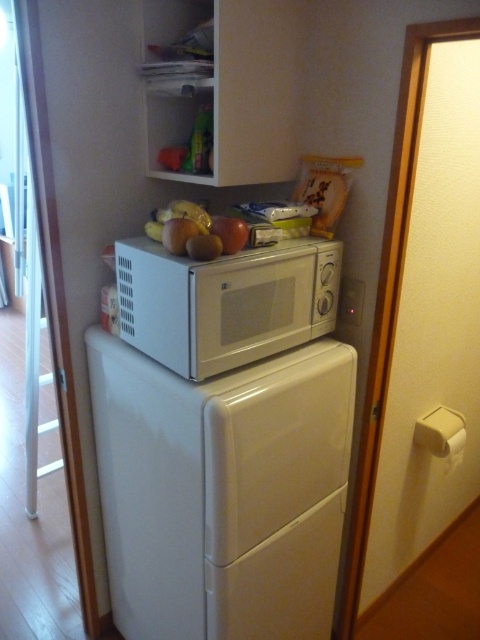
Question: Which object appears farthest from the camera in this image?

Choices:
 (A) matte red apple at center
 (B) shiny golden apple at upper center

Answer: (B)

Question: Is yellow matte apple at upper center to the right of matte red apple at center from the viewer's perspective?

Choices:
 (A) yes
 (B) no

Answer: (B)

Question: Is white matte microwave at center above matte red apple at center?

Choices:
 (A) yes
 (B) no

Answer: (B)

Question: Which object is the farthest from the white matte microwave at center?

Choices:
 (A) matte red apple at center
 (B) shiny golden apple at upper center
 (C) white glossy refrigerator at center
 (D) matte yellow apple at center

Answer: (C)

Question: Is yellow matte apple at upper center closer to the viewer compared to matte red apple at center?

Choices:
 (A) no
 (B) yes

Answer: (A)

Question: Which object is closer to the camera taking this photo?

Choices:
 (A) shiny golden apple at upper center
 (B) matte yellow apple at center

Answer: (A)